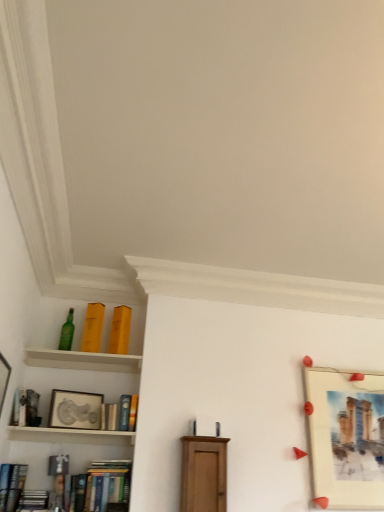
This screenshot has height=512, width=384. I want to click on unoccupied region to the right of green glass bottle at upper left, so click(x=82, y=360).